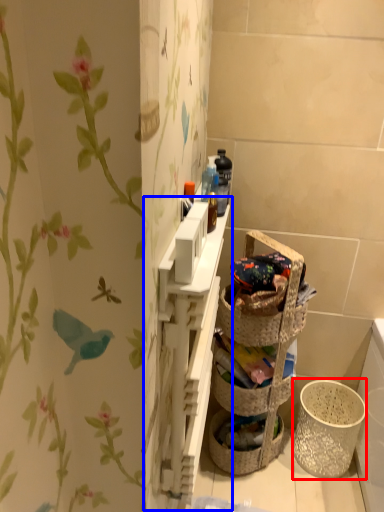
Question: Which point is further to the camera, basket container (highlighted by a red box) or cabinet (highlighted by a blue box)?

Choices:
 (A) basket container
 (B) cabinet

Answer: (A)